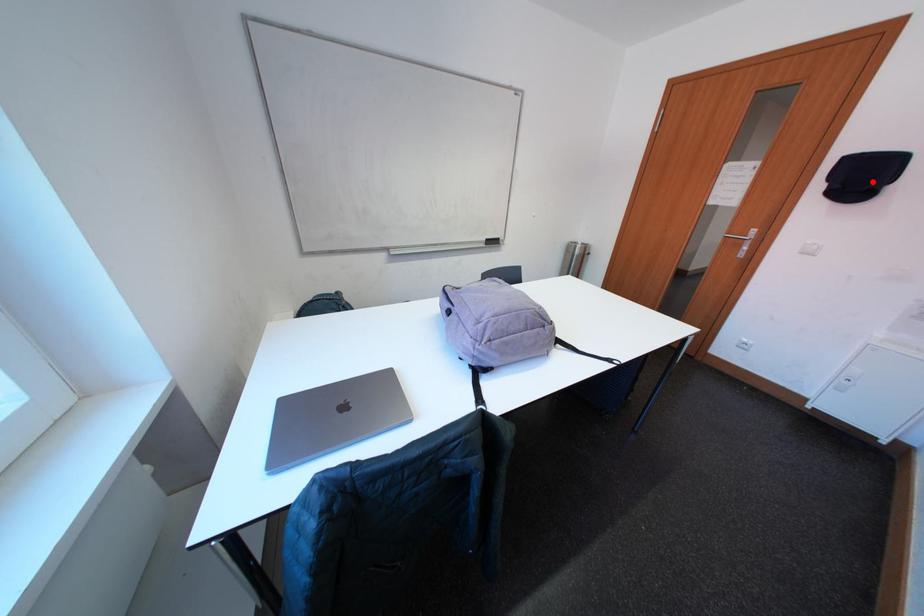
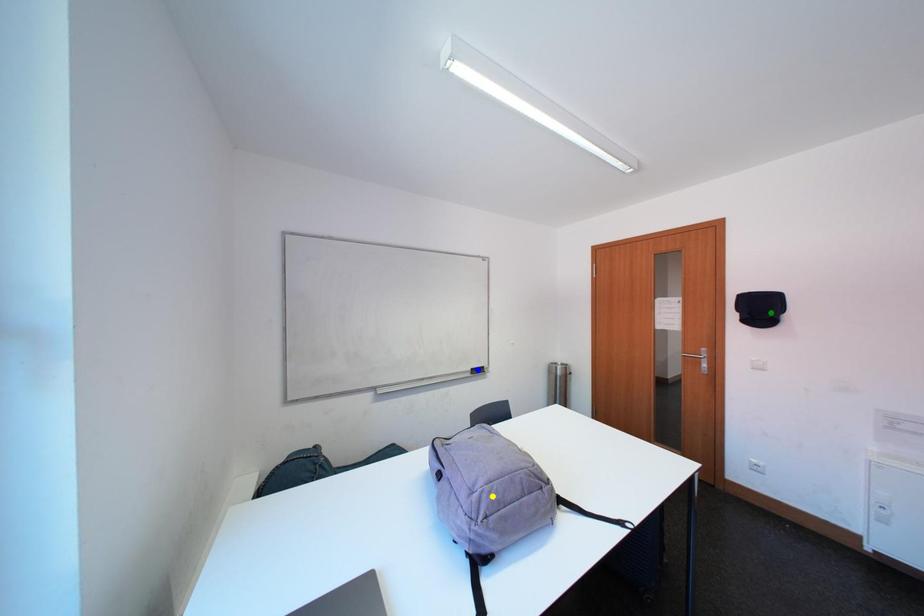
Question: I am providing you with two images of the same scene from different viewpoints. A red point is marked on the first image. You are given multiple points on the second image. Which point in image 2 is actually the same real-world point as the red point in image 1?

Choices:
 (A) blue point
 (B) green point
 (C) yellow point

Answer: (B)